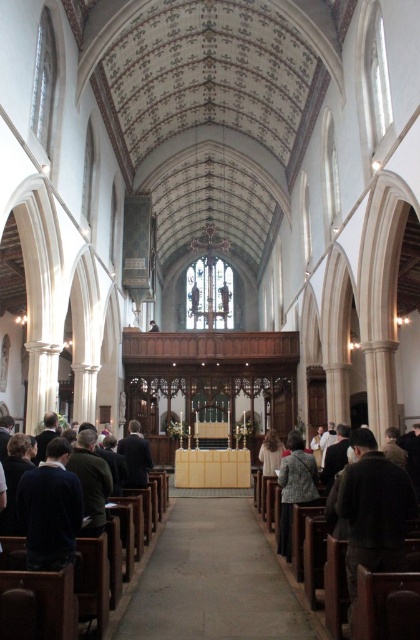
You are a photographer setting up equipment in the church. You need to place a 1.2 meter wide camera stand between the dark brown leather jacket at lower right and the patterned fabric coat at lower center. Can you fit it there?

The dark brown leather jacket at lower right might be wider than the patterned fabric coat at lower center, but without exact measurements, it is uncertain if the space between them can accommodate a 1.2 meter wide camera stand. Further measurement is needed.

You are standing in the church and see the point marked at coordinates (x=372, y=509). Which object is this point located on?

The point at coordinates (x=372, y=509) is located on the dark brown leather jacket at lower right.